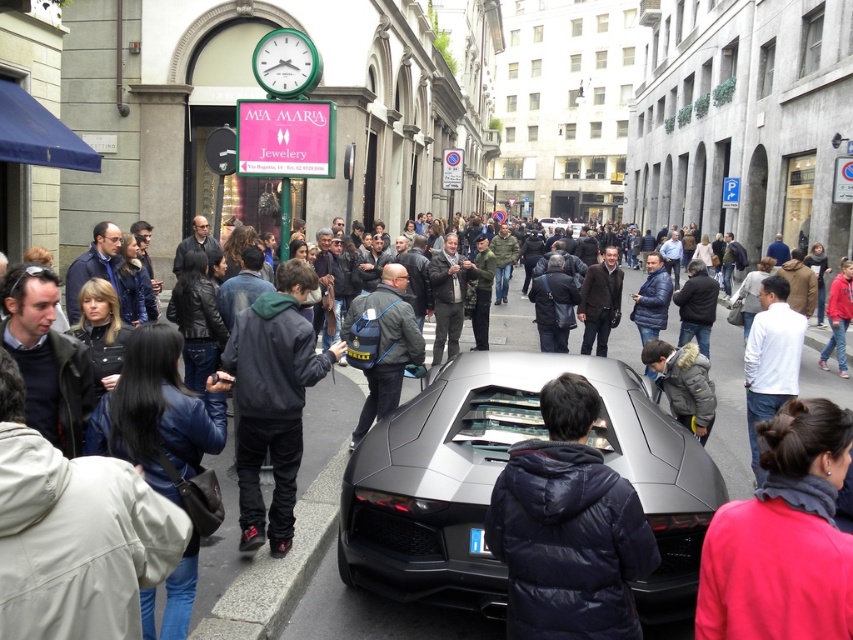
You are a photographer standing in the middle of the street and want to take a photo of the dark gray backpack at center and the white matte shirt at center. Which object will appear closer to the camera in the photo?

The dark gray backpack at center will appear closer to the camera because it is further to the viewer than the white matte shirt at center.

You are standing on the street looking at the sports car and two points marked in the image. Which point, point (711, 436) or point (178, 496), is closer to you?

Point (711, 436) is further to the viewer than point (178, 496), so point (178, 496) is closer to you.

Looking at this image, you are a photographer standing in front of the dark gray jacket at center and the gray down jacket at center. Which jacket is blocking your view of the other?

The dark gray jacket at center is blocking the view of the gray down jacket at center because it is in front of it.